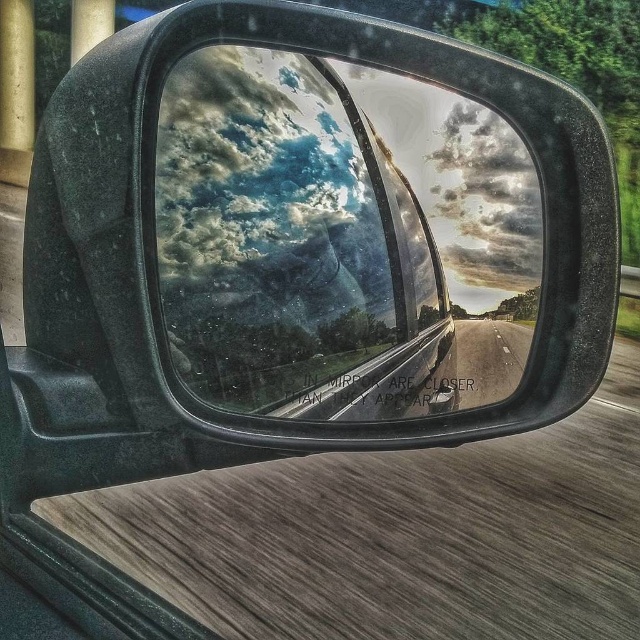
Can you confirm if transparent glass car window at center is positioned to the right of asphalt road at center?

No, transparent glass car window at center is not to the right of asphalt road at center.

Is point (179, 300) positioned before point (512, 360)?

Yes.

The image size is (640, 640). I want to click on transparent glass car window at center, so (x=291, y=244).